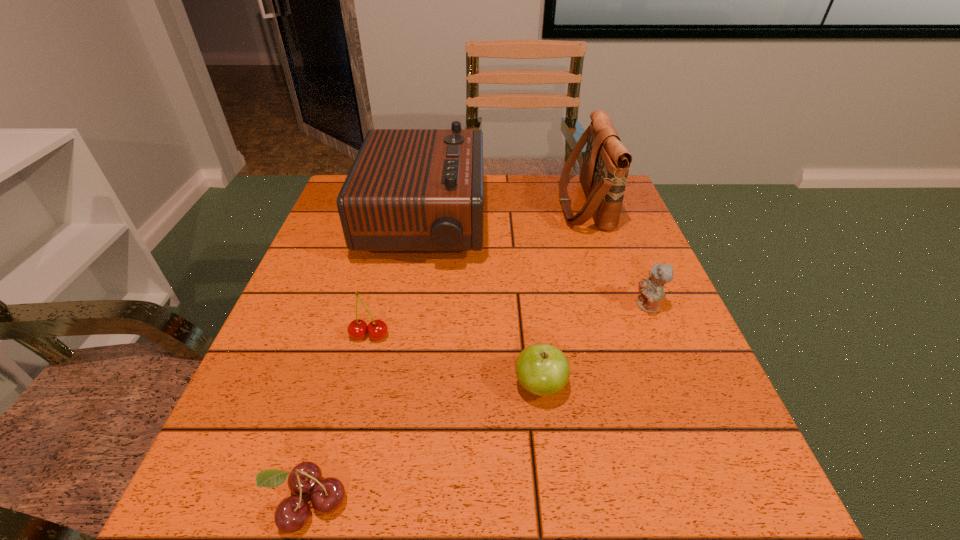
Identify which object is the fifth closest to the second nearest object. Please provide its 2D coordinates. Your answer should be formatted as a tuple, i.e. [(x, y)], where the tuple contains the x and y coordinates of a point satisfying the conditions above.

[(606, 163)]

Identify the location of free location that satisfies the following two spatial constraints: 1. on the tuning display of the radio receiver; 2. on the left side of the fourth object from left to right. Image resolution: width=960 pixels, height=540 pixels. (396, 386).

At what (x,y) coordinates should I click in order to perform the action: click on vacant region that satisfies the following two spatial constraints: 1. on the front-facing side of the shoulder bag; 2. on the leaves of the nearest object. Please return your answer as a coordinate pair (x, y). Looking at the image, I should click on (684, 503).

The image size is (960, 540). I want to click on free space that satisfies the following two spatial constraints: 1. on the tuning display of the radio receiver; 2. on the back side of the apple, so click(x=396, y=386).

In order to click on free space that satisfies the following two spatial constraints: 1. with the stems of the farther cherry pointing upwards; 2. on the right side of the apple in this screenshot , I will do `click(357, 386)`.

Image resolution: width=960 pixels, height=540 pixels. I want to click on free location that satisfies the following two spatial constraints: 1. on the tuning display of the radio receiver; 2. on the left side of the apple, so click(396, 386).

Locate an element on the screen. Image resolution: width=960 pixels, height=540 pixels. vacant region that satisfies the following two spatial constraints: 1. on the tuning display of the radio receiver; 2. on the right side of the second nearest object is located at coordinates (396, 386).

The image size is (960, 540). What are the coordinates of `vacant area that satisfies the following two spatial constraints: 1. on the front-facing side of the shoulder bag; 2. with the stems of the third nearest object pointing upwards` in the screenshot? It's located at (628, 335).

Identify the location of free region that satisfies the following two spatial constraints: 1. on the tuning display of the radio receiver; 2. on the leaves of the nearest object. (376, 503).

Identify the location of vacant area in the image that satisfies the following two spatial constraints: 1. on the front-facing side of the teddy bear; 2. with the stems of the farther cherry pointing upwards. The image size is (960, 540). (660, 335).